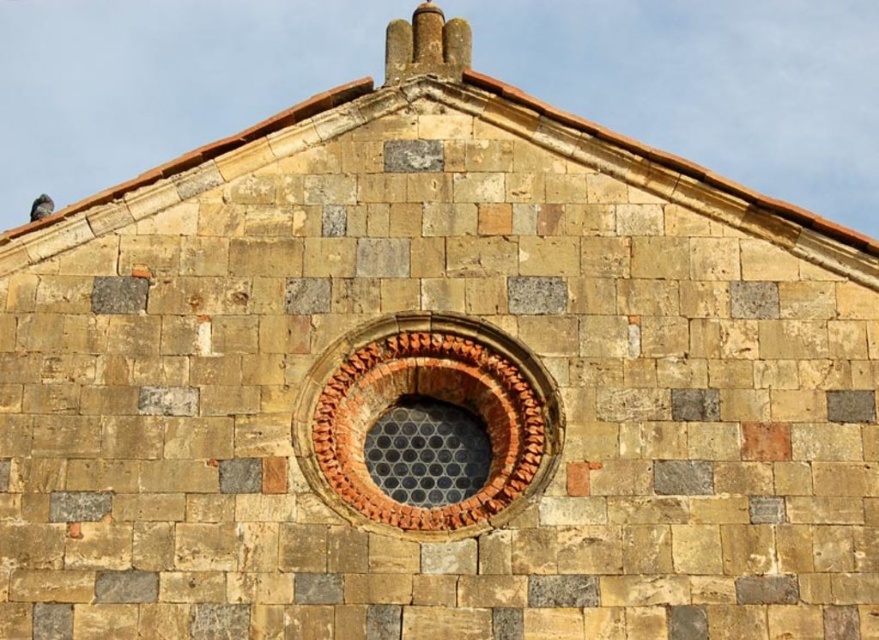
Which is below, terracotta brick window at center or gray feathered pigeon at upper left?

terracotta brick window at center is below.

Who is positioned more to the right, terracotta brick window at center or gray feathered pigeon at upper left?

From the viewer's perspective, terracotta brick window at center appears more on the right side.

Find the location of a particular element. terracotta brick window at center is located at coordinates (429, 397).